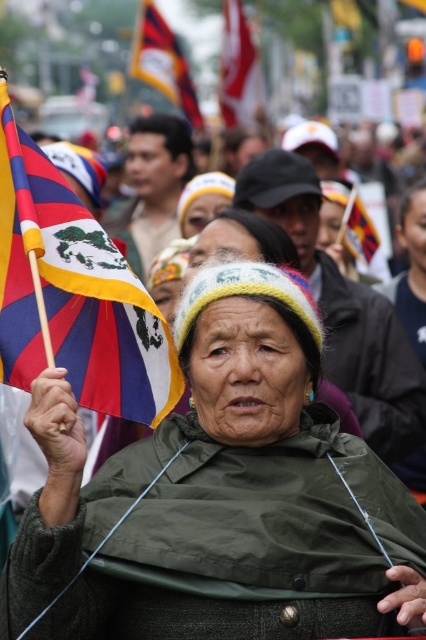
Question: Estimate the real-world distances between objects in this image. Which object is closer to the striped fabric flag at upper center?

Choices:
 (A) polyester flag at left
 (B) white fabric flag at upper center
 (C) red fabric flag at upper right
 (D) green knitted hat at upper center

Answer: (B)

Question: Is green knitted hat at upper center wider than striped fabric flag at upper center?

Choices:
 (A) no
 (B) yes

Answer: (A)

Question: Is green knitted hat at upper center below red fabric flag at upper right?

Choices:
 (A) yes
 (B) no

Answer: (A)

Question: Which point is closer to the camera?

Choices:
 (A) (238, 72)
 (B) (89, 228)

Answer: (B)

Question: Among these points, which one is nearest to the camera?

Choices:
 (A) (342, 243)
 (B) (100, 582)
 (C) (161, 74)

Answer: (B)

Question: Can you confirm if green knitted hat at upper center is bigger than red fabric flag at upper right?

Choices:
 (A) yes
 (B) no

Answer: (A)